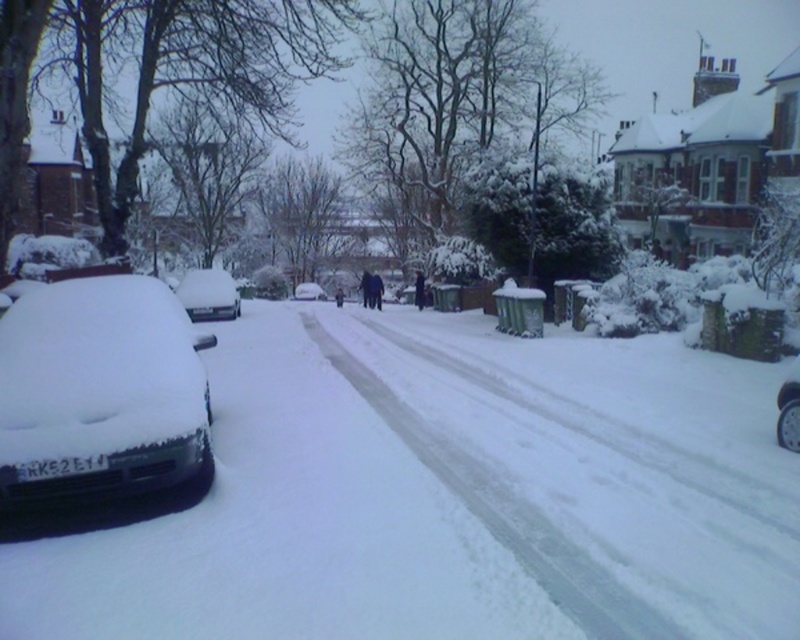
You are standing at the origin point of the image. Which of the two points, point (240, 307) or point (308, 285), is closer to you?

Point (308, 285) is closer to you because it has a higher y coordinate value of 0.385 compared to point (240, 307) with a y coordinate of 0.300. In image coordinate systems, lower y values indicate positions further away from the viewer.

You are standing at the point marked by the coordinates point (308, 291) in the snowy scene. Looking around, you see a white matte car at center. What is the nearest object to you besides the car?

The nearest object to you besides the white matte car at center is the snow on the ground, as the coordinates mark the location of the car itself, and the snow is the immediate surrounding surface.